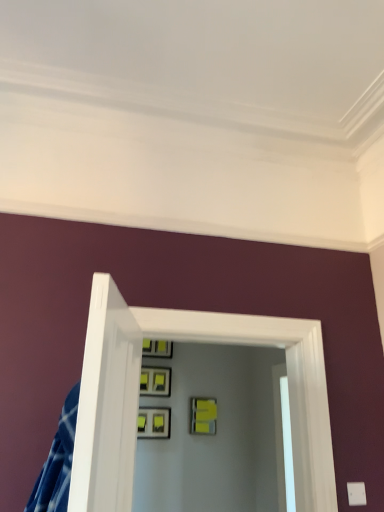
Question: From a real-world perspective, is matte black picture frame at upper center, which is the fourth picture frame in bottom-to-top order, physically below clear glass door at center?

Choices:
 (A) yes
 (B) no

Answer: (B)

Question: Is matte black picture frame at upper center, which is the fourth picture frame in bottom-to-top order, turned away from clear glass door at center?

Choices:
 (A) yes
 (B) no

Answer: (B)

Question: Is matte black picture frame at upper center, which is the fourth picture frame in bottom-to-top order, smaller than clear glass door at center?

Choices:
 (A) no
 (B) yes

Answer: (B)

Question: Is matte black picture frame at upper center, the first picture frame positioned from the top, bigger than clear glass door at center?

Choices:
 (A) yes
 (B) no

Answer: (B)

Question: Is matte black picture frame at upper center, the first picture frame positioned from the top, outside of clear glass door at center?

Choices:
 (A) no
 (B) yes

Answer: (B)

Question: Looking at their shapes, would you say matte yellow picture frame at center, positioned as the 2th picture frame in bottom-to-top order, is wider or thinner than matte black picture frame at upper center, the first picture frame positioned from the top?

Choices:
 (A) thin
 (B) wide

Answer: (A)

Question: Considering the positions of matte yellow picture frame at center, the 3th picture frame from the top, and matte black picture frame at upper center, the first picture frame positioned from the top, in the image, is matte yellow picture frame at center, the 3th picture frame from the top, bigger or smaller than matte black picture frame at upper center, the first picture frame positioned from the top,?

Choices:
 (A) small
 (B) big

Answer: (A)

Question: From the image's perspective, is matte yellow picture frame at center, the 3th picture frame from the top, located above or below matte black picture frame at upper center, the first picture frame positioned from the top?

Choices:
 (A) above
 (B) below

Answer: (B)

Question: Would you say matte yellow picture frame at center, positioned as the 2th picture frame in bottom-to-top order, is to the left or to the right of matte black picture frame at upper center, the first picture frame positioned from the top, in the picture?

Choices:
 (A) right
 (B) left

Answer: (A)

Question: Considering the positions of point (153, 434) and point (205, 426), is point (153, 434) closer or farther from the camera than point (205, 426)?

Choices:
 (A) closer
 (B) farther

Answer: (A)

Question: In the image, is matte gray picture frame at center, positioned as the 1th picture frame in bottom-to-top order, positioned in front of or behind matte yellow picture frame at center, positioned as the 2th picture frame in bottom-to-top order?

Choices:
 (A) front
 (B) behind

Answer: (A)

Question: Visually, is matte gray picture frame at center, positioned as the 1th picture frame in bottom-to-top order, positioned to the left or to the right of matte yellow picture frame at center, positioned as the 2th picture frame in bottom-to-top order?

Choices:
 (A) left
 (B) right

Answer: (A)

Question: From a real-world perspective, relative to matte yellow picture frame at center, the 3th picture frame from the top, is matte gray picture frame at center, positioned as the 1th picture frame in bottom-to-top order, vertically above or below?

Choices:
 (A) below
 (B) above

Answer: (A)

Question: Do you think clear glass door at center is within matte black picture frame at center, which appears as the 3th picture frame when ordered from the bottom, or outside of it?

Choices:
 (A) inside
 (B) outside

Answer: (B)

Question: Looking at the image, does clear glass door at center seem bigger or smaller compared to matte black picture frame at center, which appears as the 3th picture frame when ordered from the bottom?

Choices:
 (A) big
 (B) small

Answer: (A)